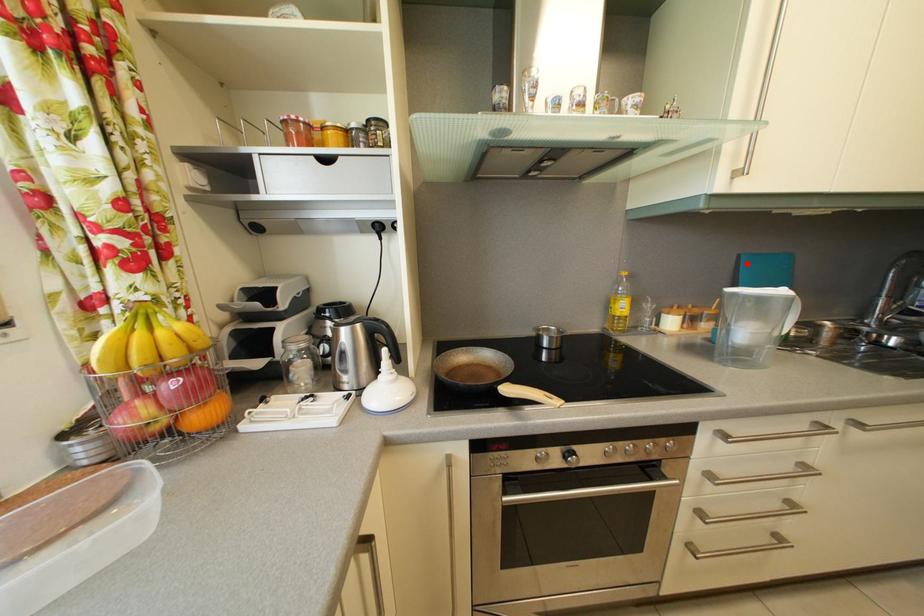
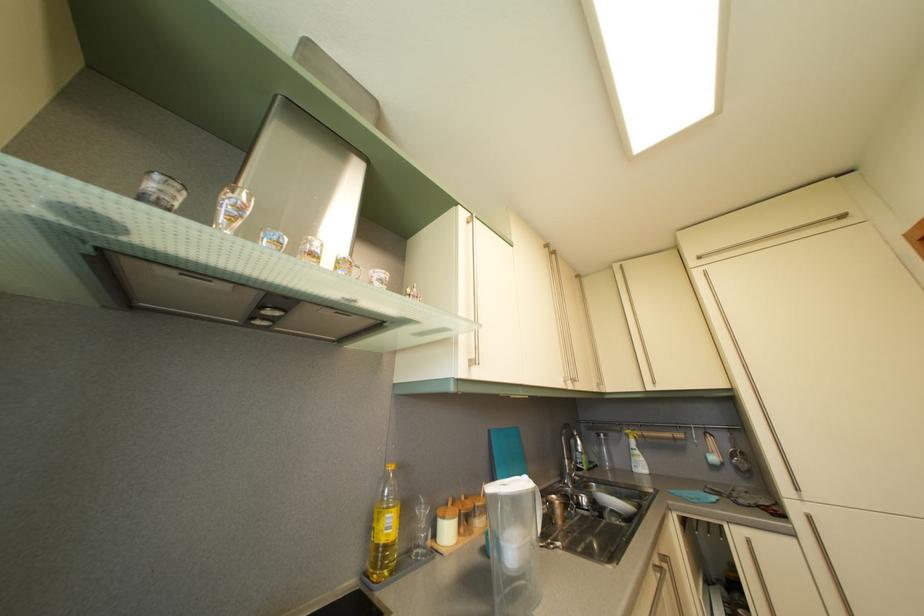
Question: I am providing you with two images of the same scene from different viewpoints. In image1, a red point is highlighted. Considering the same 3D point in image2, which of the following is correct?

Choices:
 (A) It is closer
 (B) It is farther

Answer: (B)